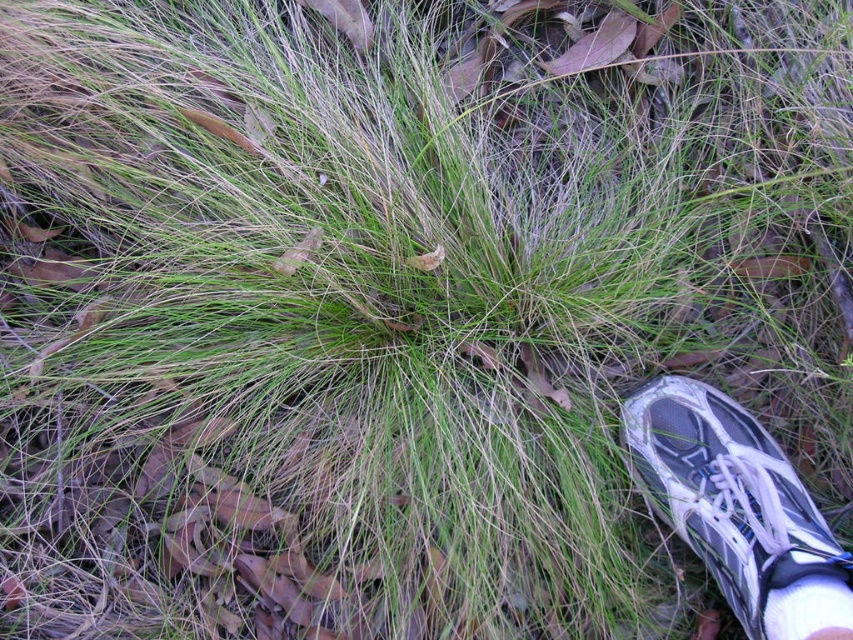
Does white mesh shoe at lower right have a greater width compared to white fabric sock at lower right?

Correct, the width of white mesh shoe at lower right exceeds that of white fabric sock at lower right.

Who is more distant from viewer, [799,588] or [817,592]?

The point [799,588] is behind.

Locate an element on the screen. The height and width of the screenshot is (640, 853). white mesh shoe at lower right is located at coordinates (738, 509).